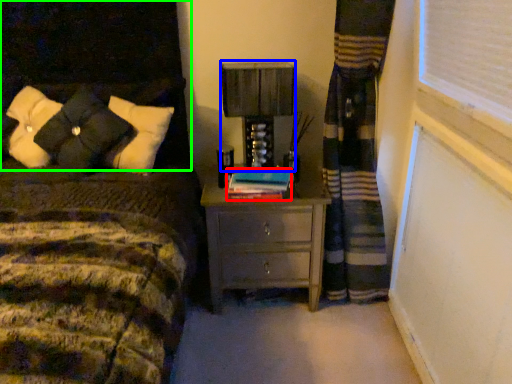
Question: Estimate the real-world distances between objects in this image. Which object is closer to book (highlighted by a red box), table lamp (highlighted by a blue box) or headboard (highlighted by a green box)?

Choices:
 (A) table lamp
 (B) headboard

Answer: (A)